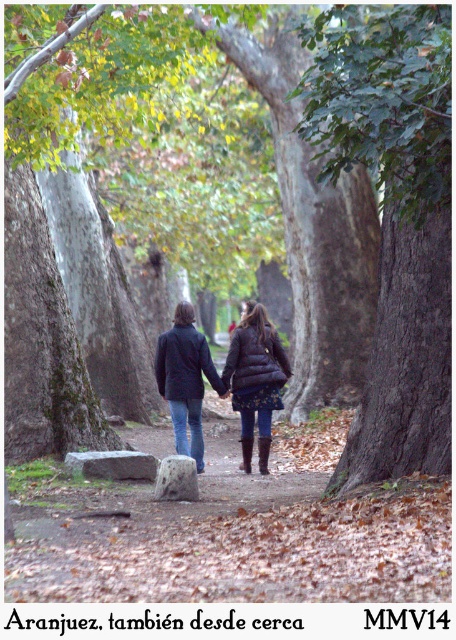
Can you confirm if brown rough bark tree at center is smaller than matte black jackets at center?

Incorrect, brown rough bark tree at center is not smaller in size than matte black jackets at center.

Does brown rough bark tree at center lie behind matte black jackets at center?

No, it is in front of matte black jackets at center.

What do you see at coordinates (393, 218) in the screenshot? The image size is (456, 640). I see `brown rough bark tree at center` at bounding box center [393, 218].

This screenshot has width=456, height=640. I want to click on brown rough bark tree at center, so (x=393, y=218).